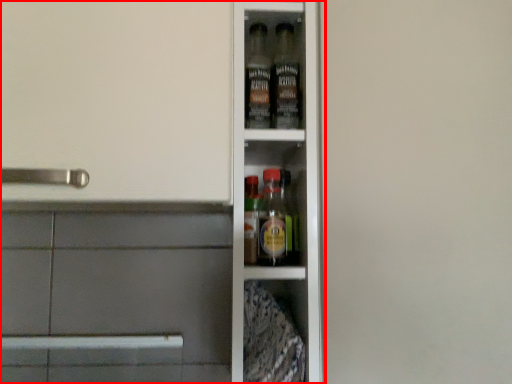
Question: Where is shelf (annotated by the red box) located in relation to screen door in the image?

Choices:
 (A) right
 (B) left

Answer: (B)